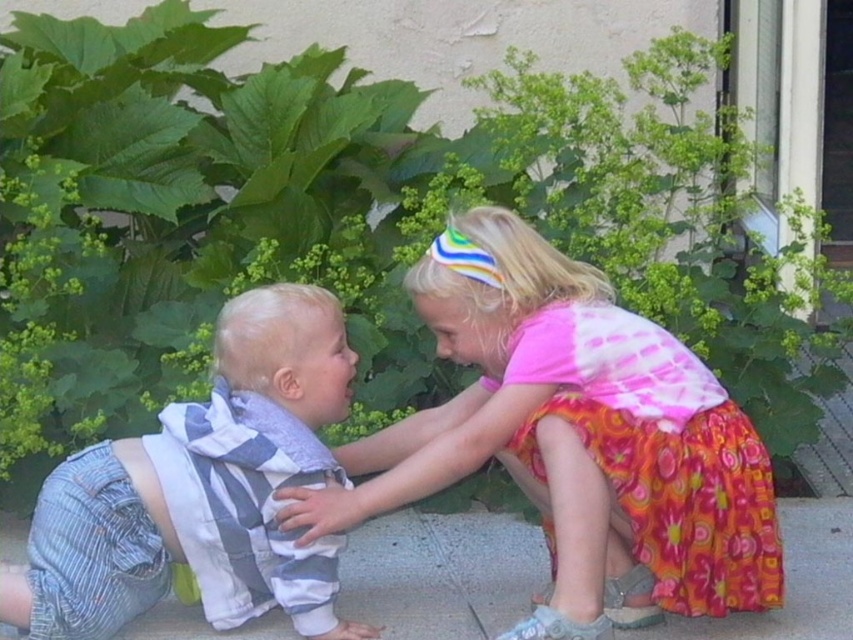
Question: Which point is farther from the camera taking this photo?

Choices:
 (A) (198, 474)
 (B) (630, 516)
 (C) (724, 579)

Answer: (A)

Question: Observing the image, what is the correct spatial positioning of multicolored fabric dress at center in reference to striped cotton shirt at lower left?

Choices:
 (A) above
 (B) below

Answer: (A)

Question: Estimate the real-world distances between objects in this image. Which object is farther from the floral cotton dress at lower right?

Choices:
 (A) striped cotton shirt at lower left
 (B) multicolored fabric dress at center

Answer: (A)

Question: Is striped cotton shirt at lower left positioned behind floral cotton dress at lower right?

Choices:
 (A) no
 (B) yes

Answer: (B)

Question: Which object is the closest to the multicolored fabric dress at center?

Choices:
 (A) striped cotton shirt at lower left
 (B) floral cotton dress at lower right

Answer: (B)

Question: Is multicolored fabric dress at center thinner than floral cotton dress at lower right?

Choices:
 (A) no
 (B) yes

Answer: (A)